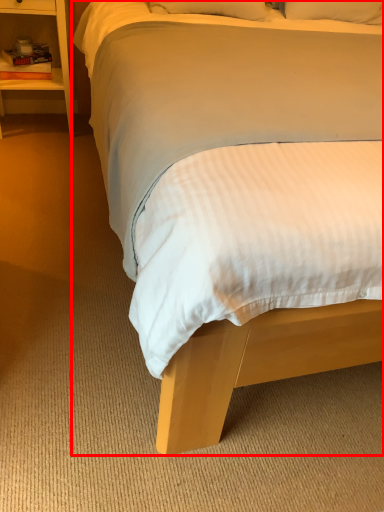
Question: Where is bed (annotated by the red box) located in relation to nightstand in the image?

Choices:
 (A) right
 (B) left

Answer: (A)